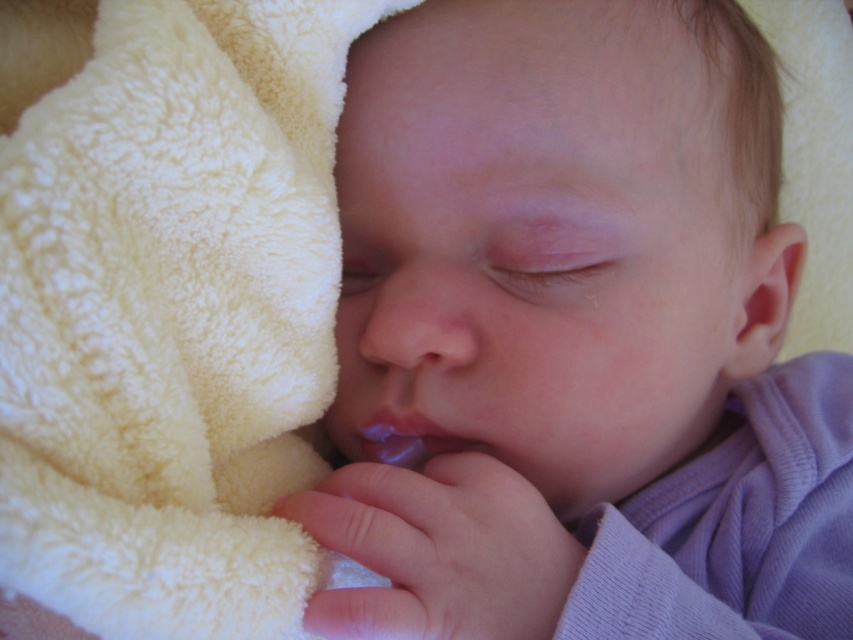
Does creamy soft blanket at left have a greater height compared to purple glossy lips at center?

Yes.

Who is positioned more to the right, creamy soft blanket at left or purple glossy lips at center?

Positioned to the right is purple glossy lips at center.

Looking at this image, who is more forward, (306, 420) or (419, 468)?

Point (306, 420)

Where is `creamy soft blanket at left`? creamy soft blanket at left is located at coordinates (167, 307).

Measure the distance between smooth skin nose at center and purple glossy lips at center.

They are 1.87 inches apart.

Does smooth skin nose at center appear on the left side of purple glossy lips at center?

Indeed, smooth skin nose at center is positioned on the left side of purple glossy lips at center.

Does point (451, 365) come in front of point (358, 424)?

Yes, point (451, 365) is closer to viewer.

Where is `smooth skin nose at center`? The width and height of the screenshot is (853, 640). smooth skin nose at center is located at coordinates (410, 314).

Is point (717, 8) positioned in front of point (402, 333)?

No, (717, 8) is behind (402, 333).

Between smooth purple cloth at center and smooth skin nose at center, which one has more height?

Standing taller between the two is smooth purple cloth at center.

Which is in front, point (451, 454) or point (479, 285)?

Point (451, 454) is more forward.

You are a GUI agent. You are given a task and a screenshot of the screen. Output one action in this format:
    pyautogui.click(x=<x>, y=<y>)
    Task: Click on the smooth purple cloth at center
    The width and height of the screenshot is (853, 640).
    Given the screenshot: What is the action you would take?
    pyautogui.click(x=587, y=337)